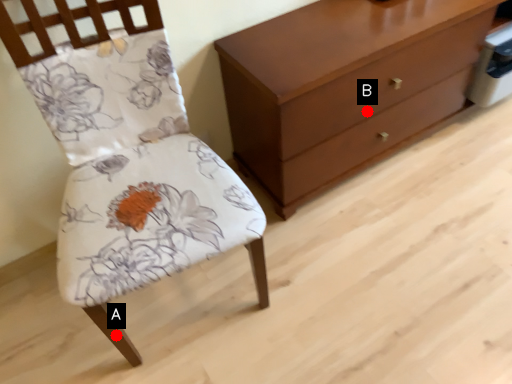
Question: Two points are circled on the image, labeled by A and B beside each circle. Which point is closer to the camera?

Choices:
 (A) A is closer
 (B) B is closer

Answer: (A)